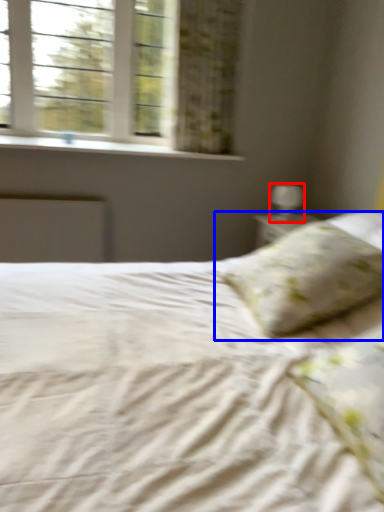
Question: Which of the following is the closest to the observer, table lamp (highlighted by a red box) or pillow (highlighted by a blue box)?

Choices:
 (A) table lamp
 (B) pillow

Answer: (B)